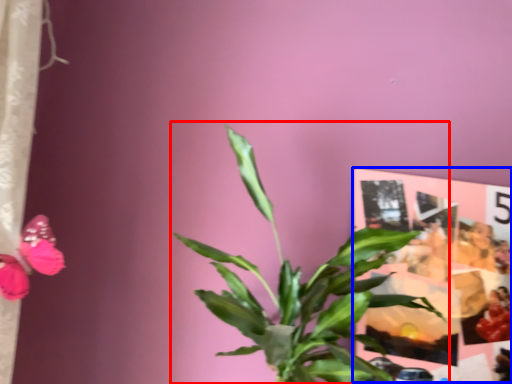
Question: Which object appears closest to the camera in this image, houseplant (highlighted by a red box) or postcard (highlighted by a blue box)?

Choices:
 (A) houseplant
 (B) postcard

Answer: (A)